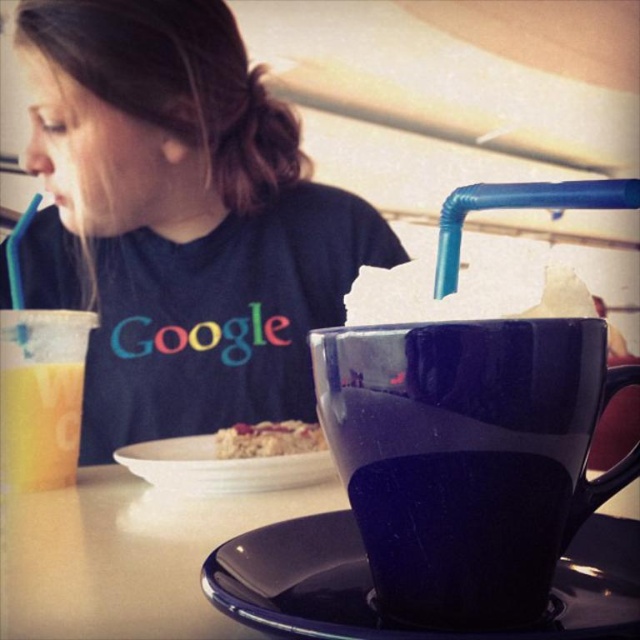
You are a customer at the restaurant and want to place your napkin between the two points, point (x=224, y=333) and point (x=324, y=452). Which point should you place the napkin closer to in order for it to appear closer to you?

You should place the napkin closer to point (x=224, y=333) because it is already further to the camera than point (x=324, y=452), so placing the napkin near it will make it appear closer to you.